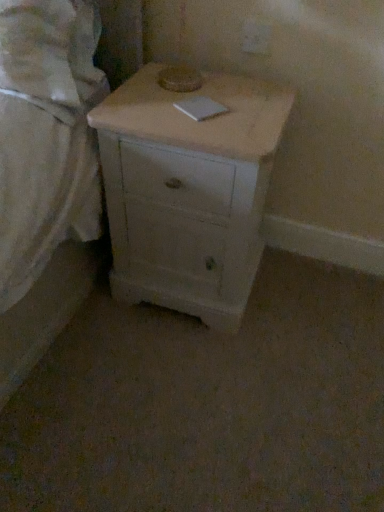
The width and height of the screenshot is (384, 512). Describe the element at coordinates (46, 135) in the screenshot. I see `white matte bed at left` at that location.

This screenshot has height=512, width=384. Find the location of `white matte bed at left`. white matte bed at left is located at coordinates (46, 135).

Where is `white matte chest of drawers at center`? white matte chest of drawers at center is located at coordinates (188, 191).

What do you see at coordinates (188, 191) in the screenshot? I see `white matte chest of drawers at center` at bounding box center [188, 191].

Locate an element on the screen. The image size is (384, 512). white matte bed at left is located at coordinates (46, 135).

Which object is positioned more to the right, white matte chest of drawers at center or white matte bed at left?

Positioned to the right is white matte chest of drawers at center.

Considering the positions of objects white matte chest of drawers at center and white matte bed at left in the image provided, who is in front, white matte chest of drawers at center or white matte bed at left?

white matte bed at left is in front.

Considering the positions of points (286, 96) and (25, 150), is point (286, 96) closer to camera compared to point (25, 150)?

No.

From the image's perspective, is white matte chest of drawers at center below white matte bed at left?

Indeed, from the image's perspective, white matte chest of drawers at center is shown beneath white matte bed at left.

From a real-world perspective, is white matte chest of drawers at center physically above white matte bed at left?

No, from a real-world perspective, white matte chest of drawers at center is not above white matte bed at left.

Considering the sizes of objects white matte chest of drawers at center and white matte bed at left in the image provided, who is wider, white matte chest of drawers at center or white matte bed at left?

white matte chest of drawers at center.

Which of these two, white matte chest of drawers at center or white matte bed at left, stands shorter?

white matte bed at left.

Looking at the image, does white matte chest of drawers at center seem bigger or smaller compared to white matte bed at left?

white matte chest of drawers at center is bigger than white matte bed at left.

Does white matte chest of drawers at center contain white matte bed at left?

That's incorrect, white matte bed at left is not inside white matte chest of drawers at center.

Is white matte chest of drawers at center far away from white matte bed at left?

That's not correct — white matte chest of drawers at center is a little close to white matte bed at left.

Could you tell me if white matte chest of drawers at center is turned towards white matte bed at left?

No.

Can you tell me how much white matte chest of drawers at center and white matte bed at left differ in facing direction?

1.41 degrees separate the facing orientations of white matte chest of drawers at center and white matte bed at left.

Image resolution: width=384 pixels, height=512 pixels. Find the location of `chest of drawers on the right side of white matte bed at left`. chest of drawers on the right side of white matte bed at left is located at coordinates (188, 191).

In the image, is white matte bed at left on the left side or the right side of white matte chest of drawers at center?

Clearly, white matte bed at left is on the left of white matte chest of drawers at center in the image.

Does white matte bed at left come in front of white matte chest of drawers at center?

Yes, white matte bed at left is closer to the camera.

Considering the points (79, 231) and (225, 172), which point is in front, point (79, 231) or point (225, 172)?

Point (225, 172)

Consider the image. From the image's perspective, is white matte bed at left positioned above or below white matte chest of drawers at center?

white matte bed at left is above white matte chest of drawers at center.

From a real-world perspective, is white matte bed at left above or below white matte chest of drawers at center?

Clearly, from a real-world perspective, white matte bed at left is above white matte chest of drawers at center.

Can you confirm if white matte bed at left is wider than white matte chest of drawers at center?

Incorrect, the width of white matte bed at left does not surpass that of white matte chest of drawers at center.

Is white matte bed at left shorter than white matte chest of drawers at center?

Yes, white matte bed at left is shorter than white matte chest of drawers at center.

Does white matte bed at left have a larger size compared to white matte chest of drawers at center?

No, white matte bed at left is not bigger than white matte chest of drawers at center.

Would you say white matte bed at left contains white matte chest of drawers at center?

Definitely not — white matte chest of drawers at center is not inside white matte bed at left.

Are white matte bed at left and white matte chest of drawers at center located far from each other?

No, white matte bed at left is in close proximity to white matte chest of drawers at center.

Is white matte bed at left oriented towards white matte chest of drawers at center?

No.

How many degrees apart are the facing directions of white matte bed at left and white matte chest of drawers at center?

There is a 1.41-degree angle between the facing directions of white matte bed at left and white matte chest of drawers at center.

How distant is white matte bed at left from white matte chest of drawers at center?

9.61 inches.

At what (x,y) coordinates should I click in order to perform the action: click on the chest of drawers below the white matte bed at left (from the image's perspective). Please return your answer as a coordinate pair (x, y). Image resolution: width=384 pixels, height=512 pixels. Looking at the image, I should click on (188, 191).

Locate an element on the screen. chest of drawers behind the white matte bed at left is located at coordinates (188, 191).

Locate an element on the screen. chest of drawers below the white matte bed at left (from a real-world perspective) is located at coordinates (188, 191).